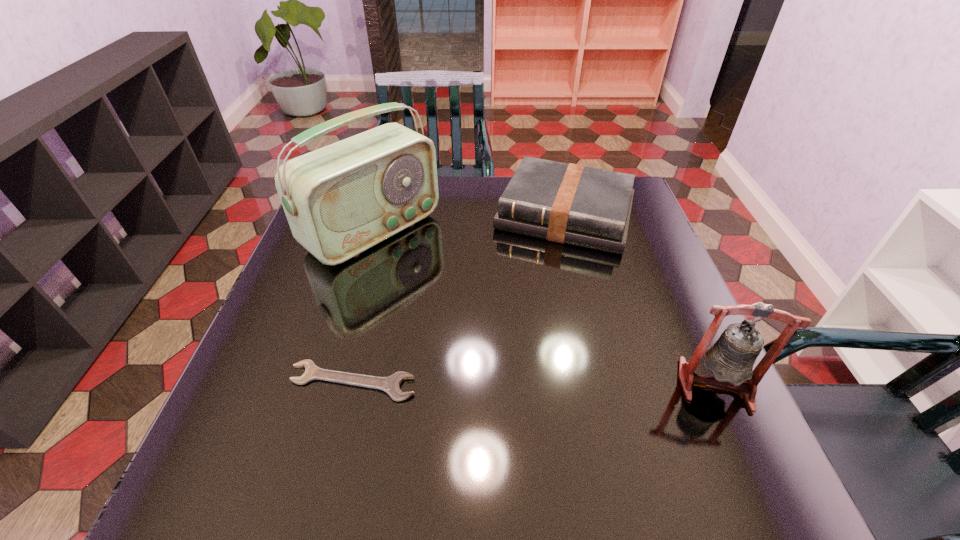
Where is `free space that satisfies the following two spatial constraints: 1. on the front side of the second tallest object; 2. on the left side of the shortest object`? Image resolution: width=960 pixels, height=540 pixels. free space that satisfies the following two spatial constraints: 1. on the front side of the second tallest object; 2. on the left side of the shortest object is located at coordinates (352, 385).

This screenshot has width=960, height=540. What are the coordinates of `free space that satisfies the following two spatial constraints: 1. on the front side of the tallest object; 2. on the left side of the wrench` in the screenshot? It's located at (329, 381).

Where is `vacant point that satisfies the following two spatial constraints: 1. on the front side of the tallest object; 2. on the left side of the third shortest object`? The height and width of the screenshot is (540, 960). vacant point that satisfies the following two spatial constraints: 1. on the front side of the tallest object; 2. on the left side of the third shortest object is located at coordinates (328, 385).